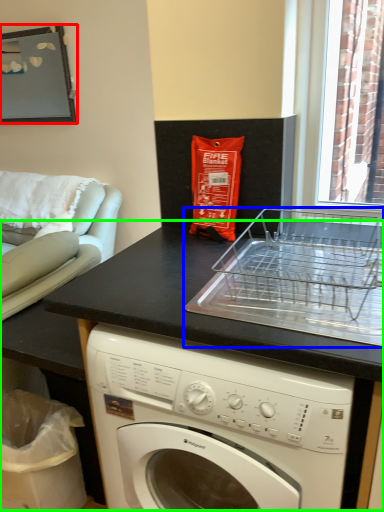
Question: Which object is the closest to the picture frame (highlighted by a red box)? Choose among these: appliance (highlighted by a blue box) or counter (highlighted by a green box).

Choices:
 (A) appliance
 (B) counter

Answer: (B)